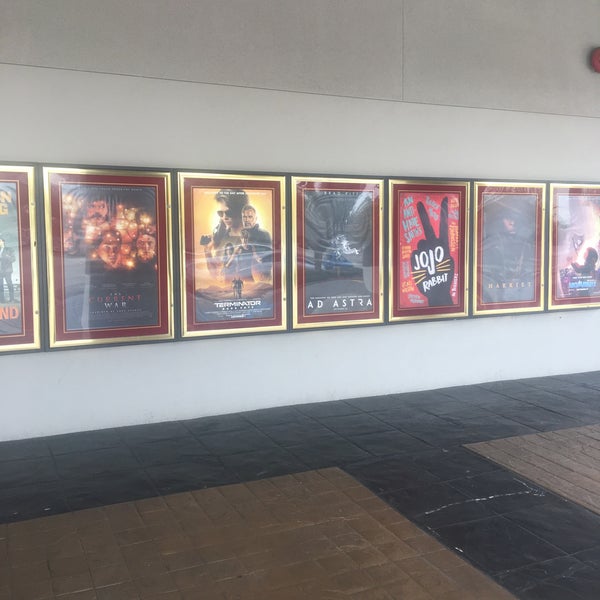
At what (x,y) coordinates should I click in order to perform the action: click on poster. Please return your answer as a coordinate pair (x, y). Looking at the image, I should click on (361, 311).